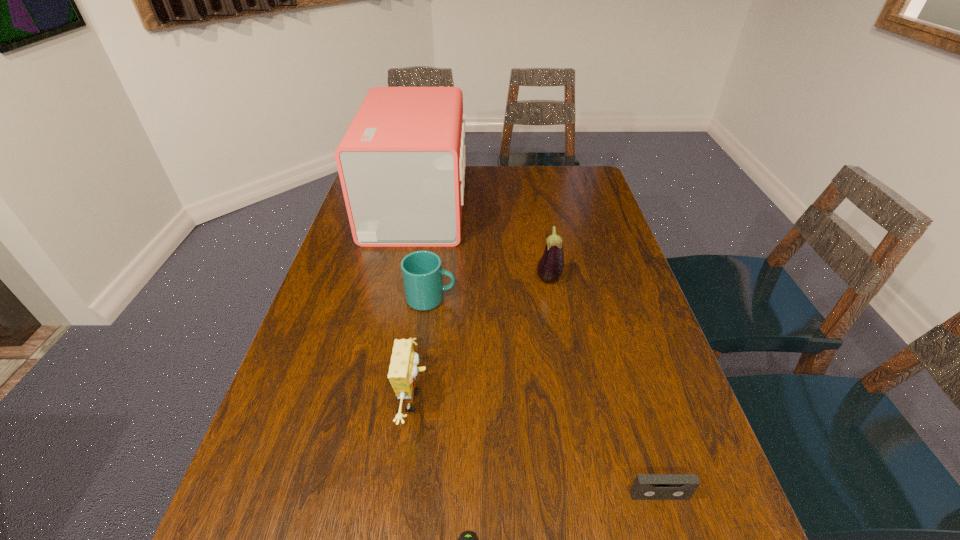
Identify the location of the farthest object. Image resolution: width=960 pixels, height=540 pixels. (401, 163).

Locate an element on the screen. Image resolution: width=960 pixels, height=540 pixels. the tallest object is located at coordinates (401, 163).

The image size is (960, 540). Identify the location of the second object from right to left. (550, 267).

At what (x,y) coordinates should I click in order to perform the action: click on the fourth farthest object. Please return your answer as a coordinate pair (x, y). The image size is (960, 540). Looking at the image, I should click on (403, 369).

The image size is (960, 540). Identify the location of sponge. (403, 369).

Find the location of `the fourth tallest object`. the fourth tallest object is located at coordinates [422, 272].

What are the coordinates of `the fifth tallest object` in the screenshot? It's located at (645, 486).

The image size is (960, 540). Identify the location of the rightmost object. (645, 486).

This screenshot has height=540, width=960. What are the coordinates of `free space located on the surface of the farthest object where the text is embossed` in the screenshot? It's located at (531, 205).

Where is `vacant space located on the left of the eggplant`? vacant space located on the left of the eggplant is located at coordinates (515, 280).